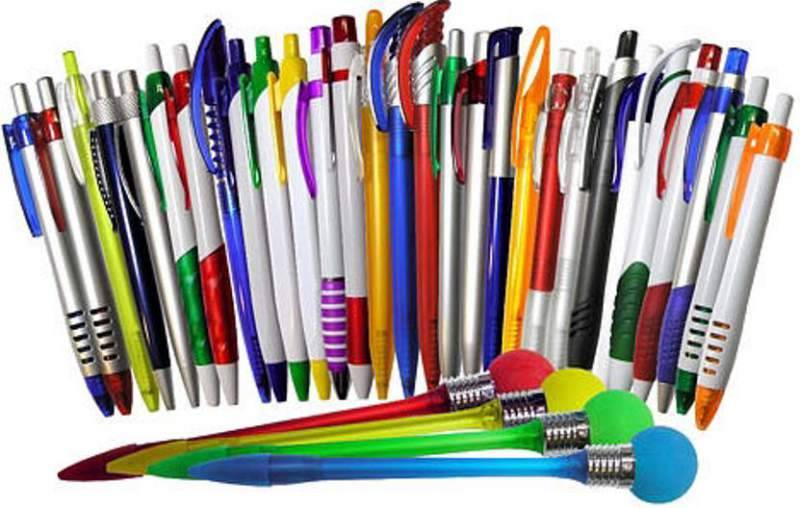
Locate an element on the screen. pens placed horizontally is located at coordinates (364, 470), (374, 444), (377, 429), (374, 409).